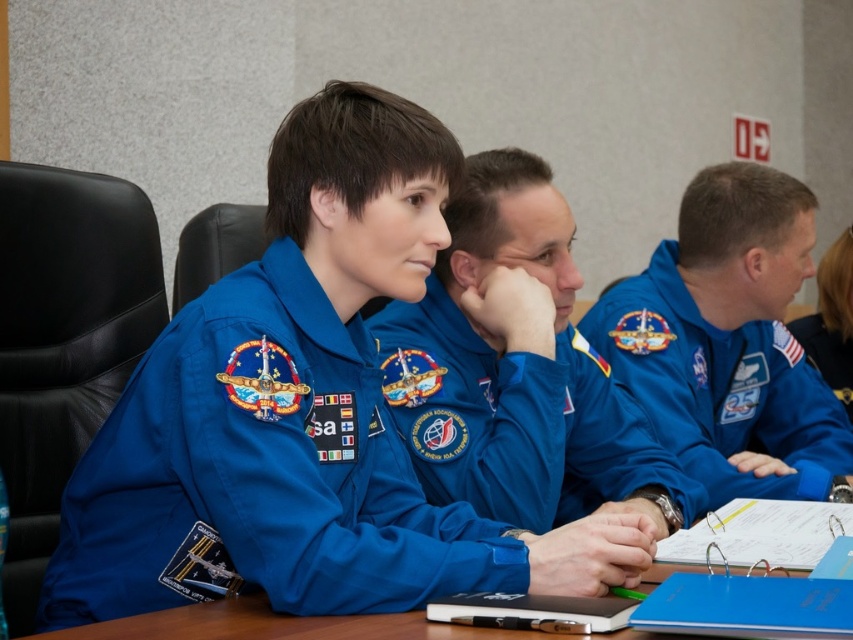
What object is located at the coordinates point [517,374] in the image?

The point [517,374] marks the blue fabric uniform at center.

From the picture: You are designing a new conference room layout and need to place a blue fabric jacket at center on top of the wooden table at center. Considering the sizes, will the jacket completely cover the table?

The blue fabric jacket at center has a width less than the wooden table at center, so it will not completely cover the table.